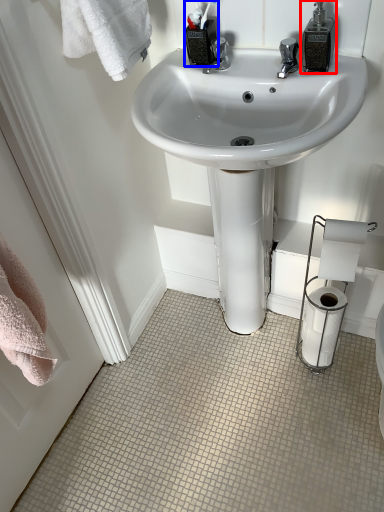
Question: Which object is further to the camera taking this photo, soap dispenser (highlighted by a red box) or toiletry (highlighted by a blue box)?

Choices:
 (A) soap dispenser
 (B) toiletry

Answer: (B)